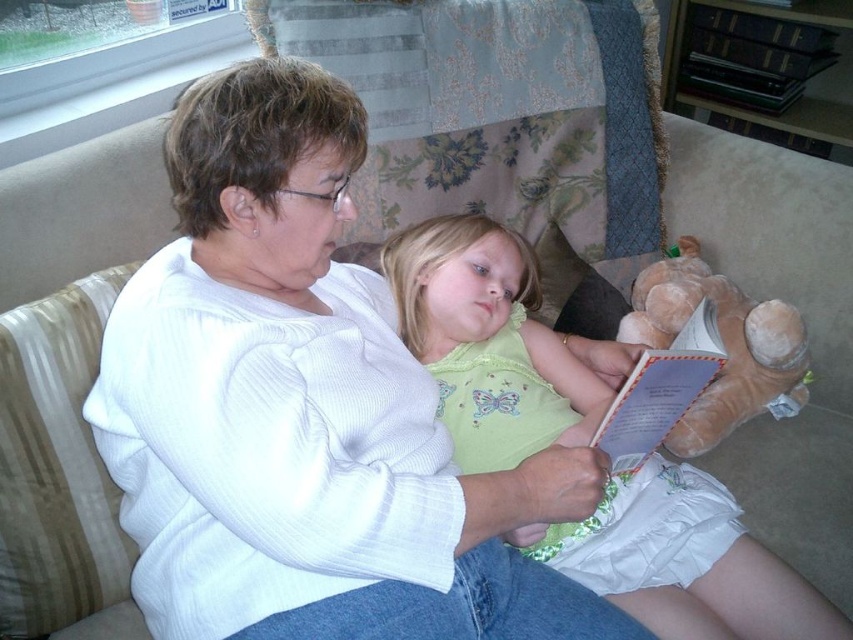
Question: Does light green fabric dress at center have a lesser width compared to soft brown plush at lower right?

Choices:
 (A) yes
 (B) no

Answer: (B)

Question: Which object is farther from the camera taking this photo?

Choices:
 (A) soft brown plush at lower right
 (B) white ribbed sweater at center

Answer: (A)

Question: Is white ribbed sweater at center below light green fabric dress at center?

Choices:
 (A) no
 (B) yes

Answer: (A)

Question: Among these points, which one is nearest to the camera?

Choices:
 (A) (735, 419)
 (B) (619, 598)

Answer: (B)

Question: Can you confirm if light green fabric dress at center is positioned to the right of soft brown plush at lower right?

Choices:
 (A) no
 (B) yes

Answer: (A)

Question: Among these points, which one is farthest from the camera?

Choices:
 (A) (395, 262)
 (B) (381, 516)
 (C) (737, 323)

Answer: (C)